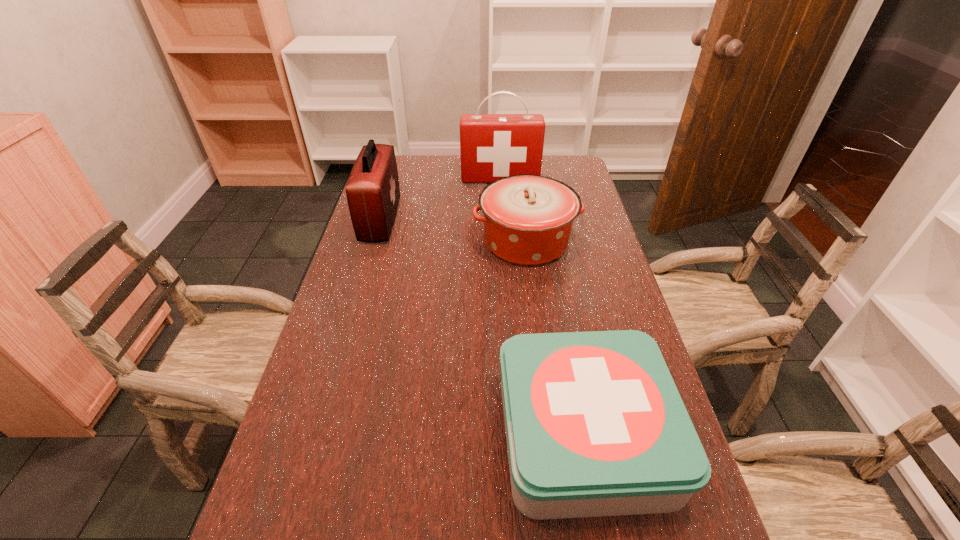
Identify the location of vacant area situated on the back of the shortest first-aid kit. (560, 296).

You are a GUI agent. You are given a task and a screenshot of the screen. Output one action in this format:
    pyautogui.click(x=<x>, y=<y>)
    Task: Click on the object located at the far edge
    
    Given the screenshot: What is the action you would take?
    pyautogui.click(x=492, y=146)

Where is `object at the left edge`? This screenshot has width=960, height=540. object at the left edge is located at coordinates (372, 190).

I want to click on casserole positioned at the right edge, so click(x=528, y=219).

Identify the location of the first-aid kit that is at the right edge. coord(595,426).

Identify the location of vacant space at the left edge of the desktop. (330, 477).

In the image, there is a desktop. At what (x,y) coordinates should I click in order to perform the action: click on free space at the right edge. Please return your answer as a coordinate pair (x, y). This screenshot has width=960, height=540. Looking at the image, I should click on (574, 264).

Where is `empty location between the farthest first-aid kit and the shortest first-aid kit`? empty location between the farthest first-aid kit and the shortest first-aid kit is located at coordinates point(543,308).

Identify the location of free space between the second shortest first-aid kit and the third tallest object. (453, 231).

Identify the location of free area in between the second tallest first-aid kit and the tallest first-aid kit. pos(441,200).